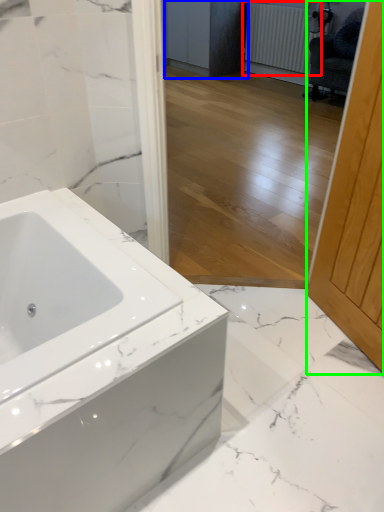
Question: Considering the real-world distances, which object is farthest from radiator (highlighted by a red box)? cabinetry (highlighted by a blue box) or screen door (highlighted by a green box)?

Choices:
 (A) cabinetry
 (B) screen door

Answer: (B)